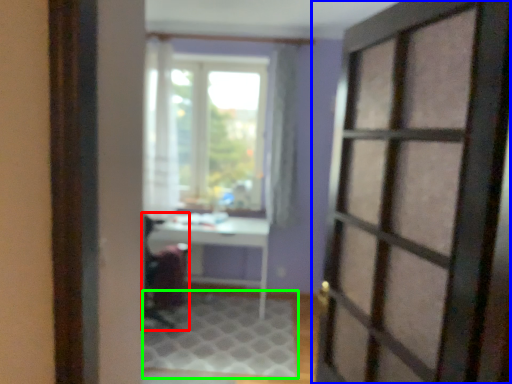
Question: Estimate the real-world distances between objects in this image. Which object is farther from armchair (highlighted by a red box), door (highlighted by a blue box) or doormat (highlighted by a green box)?

Choices:
 (A) door
 (B) doormat

Answer: (A)